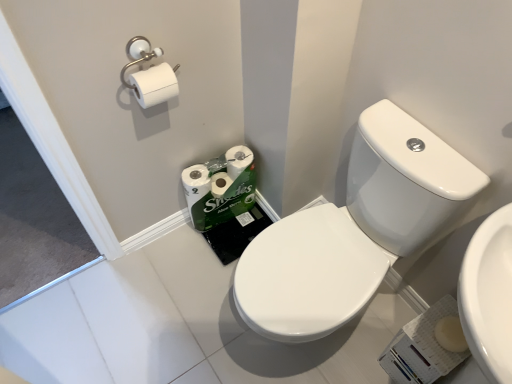
You are a GUI agent. You are given a task and a screenshot of the screen. Output one action in this format:
    pyautogui.click(x=<x>, y=<y>)
    Task: Click on the white matte toilet paper at upper left, arranged as the 2th toilet paper when ordered from the bottom
    
    Given the screenshot: What is the action you would take?
    pyautogui.click(x=154, y=85)

Locate an element on the screen. This screenshot has height=384, width=512. green matte toilet paper at lower center, the 2th toilet paper positioned from the top is located at coordinates (220, 187).

Is white matte toilet paper at upper left, the first toilet paper from the top, facing away from white glossy sink at center right?

white matte toilet paper at upper left, the first toilet paper from the top, is not turned away from white glossy sink at center right.

Is white matte toilet paper at upper left, arranged as the 2th toilet paper when ordered from the bottom, smaller than white glossy sink at center right?

Indeed, white matte toilet paper at upper left, arranged as the 2th toilet paper when ordered from the bottom, has a smaller size compared to white glossy sink at center right.

Do you think white matte toilet paper at upper left, which is the 1th toilet paper from front to back, is within white glossy sink at center right, or outside of it?

white matte toilet paper at upper left, which is the 1th toilet paper from front to back, is located beyond the bounds of white glossy sink at center right.

Can you confirm if green matte toilet paper at lower center, the second toilet paper in the front-to-back sequence, is thinner than white glossy sink at center right?

Correct, the width of green matte toilet paper at lower center, the second toilet paper in the front-to-back sequence, is less than that of white glossy sink at center right.

Based on their sizes in the image, would you say green matte toilet paper at lower center, the 2th toilet paper positioned from the top, is bigger or smaller than white glossy sink at center right?

Considering their sizes, green matte toilet paper at lower center, the 2th toilet paper positioned from the top, takes up less space than white glossy sink at center right.

From the image's perspective, is green matte toilet paper at lower center, which is counted as the first toilet paper, starting from the back, located beneath white glossy sink at center right?

No, from the image's perspective, green matte toilet paper at lower center, which is counted as the first toilet paper, starting from the back, is not below white glossy sink at center right.

From their relative heights in the image, would you say green matte toilet paper at lower center, the 2th toilet paper positioned from the top, is taller or shorter than white glossy sink at center right?

In the image, green matte toilet paper at lower center, the 2th toilet paper positioned from the top, appears to be shorter than white glossy sink at center right.

Locate an element on the screen. The height and width of the screenshot is (384, 512). the 2nd toilet paper behind when counting from the white glossy sink at center right is located at coordinates (220, 187).

Considering the relative sizes of white glossy sink at center right and green matte toilet paper at lower center, which is counted as the first toilet paper, starting from the back, in the image provided, is white glossy sink at center right bigger than green matte toilet paper at lower center, which is counted as the first toilet paper, starting from the back,?

Correct, white glossy sink at center right is larger in size than green matte toilet paper at lower center, which is counted as the first toilet paper, starting from the back.

In the scene shown: Choose the correct answer: Is white glossy sink at center right inside green matte toilet paper at lower center, the 2th toilet paper positioned from the top, or outside it?

white glossy sink at center right lies outside green matte toilet paper at lower center, the 2th toilet paper positioned from the top.

From a real-world perspective, is white glossy sink at center right beneath green matte toilet paper at lower center, the 2th toilet paper positioned from the top?

No, from a real-world perspective, white glossy sink at center right is not under green matte toilet paper at lower center, the 2th toilet paper positioned from the top.

Considering the sizes of objects white glossy sink at center right and white matte toilet paper at upper left, positioned as the second toilet paper in back-to-front order, in the image provided, who is shorter, white glossy sink at center right or white matte toilet paper at upper left, positioned as the second toilet paper in back-to-front order,?

white matte toilet paper at upper left, positioned as the second toilet paper in back-to-front order, is shorter.

Would you say white glossy sink at center right is outside white matte toilet paper at upper left, the first toilet paper from the top?

Yes.

Is the surface of white glossy sink at center right in direct contact with white matte toilet paper at upper left, the first toilet paper from the top?

white glossy sink at center right and white matte toilet paper at upper left, the first toilet paper from the top, are clearly separated.

From a real-world perspective, which is physically below, white glossy sink at center right or white matte toilet paper at upper left, positioned as the second toilet paper in back-to-front order?

white glossy sink at center right.

Relative to green matte toilet paper at lower center, which is the 1th toilet paper from bottom to top, is white matte toilet paper at upper left, which is the 1th toilet paper from front to back, in front or behind?

In the image, white matte toilet paper at upper left, which is the 1th toilet paper from front to back, appears in front of green matte toilet paper at lower center, which is the 1th toilet paper from bottom to top.

Does white matte toilet paper at upper left, the first toilet paper from the top, have a lesser width compared to green matte toilet paper at lower center, the 2th toilet paper positioned from the top?

Yes, white matte toilet paper at upper left, the first toilet paper from the top, is thinner than green matte toilet paper at lower center, the 2th toilet paper positioned from the top.

Which object is positioned more to the left, white matte toilet paper at upper left, positioned as the second toilet paper in back-to-front order, or green matte toilet paper at lower center, the 2th toilet paper positioned from the top?

white matte toilet paper at upper left, positioned as the second toilet paper in back-to-front order, is more to the left.

From the image's perspective, which is below, white matte toilet paper at upper left, the first toilet paper from the top, or green matte toilet paper at lower center, the second toilet paper in the front-to-back sequence?

green matte toilet paper at lower center, the second toilet paper in the front-to-back sequence, appears lower in the image.

Can you tell me how much green matte toilet paper at lower center, which is counted as the first toilet paper, starting from the back, and white matte toilet paper at upper left, the first toilet paper from the top, differ in facing direction?

0.885 degrees.

In the image, is green matte toilet paper at lower center, which is counted as the first toilet paper, starting from the back, positioned in front of or behind white matte toilet paper at upper left, which is the 1th toilet paper from front to back?

green matte toilet paper at lower center, which is counted as the first toilet paper, starting from the back, is behind white matte toilet paper at upper left, which is the 1th toilet paper from front to back.

From the image's perspective, which one is positioned higher, green matte toilet paper at lower center, the 2th toilet paper positioned from the top, or white matte toilet paper at upper left, the first toilet paper from the top?

white matte toilet paper at upper left, the first toilet paper from the top.

Measure the distance from green matte toilet paper at lower center, the 2th toilet paper positioned from the top, to white matte toilet paper at upper left, positioned as the second toilet paper in back-to-front order.

19.88 inches.

I want to click on sink below the white matte toilet paper at upper left, positioned as the second toilet paper in back-to-front order (from a real-world perspective), so click(x=355, y=230).

Locate an element on the screen. sink that is above the green matte toilet paper at lower center, which is counted as the first toilet paper, starting from the back (from a real-world perspective) is located at coordinates (355, 230).

When comparing their distances from white matte toilet paper at upper left, the first toilet paper from the top, does white glossy sink at center right or green matte toilet paper at lower center, which is the 1th toilet paper from bottom to top, seem closer?

green matte toilet paper at lower center, which is the 1th toilet paper from bottom to top, is positioned closer to the anchor white matte toilet paper at upper left, the first toilet paper from the top.

Looking at the image, which one is located closer to green matte toilet paper at lower center, which is counted as the first toilet paper, starting from the back, white glossy sink at center right or white matte toilet paper at upper left, the first toilet paper from the top?

Result: white matte toilet paper at upper left, the first toilet paper from the top, is positioned closer to the anchor green matte toilet paper at lower center, which is counted as the first toilet paper, starting from the back.

Based on their spatial positions, is green matte toilet paper at lower center, which is counted as the first toilet paper, starting from the back, or white glossy sink at center right further from white matte toilet paper at upper left, positioned as the second toilet paper in back-to-front order?

Based on the image, white glossy sink at center right appears to be further to white matte toilet paper at upper left, positioned as the second toilet paper in back-to-front order.

Considering their positions, is white matte toilet paper at upper left, the first toilet paper from the top, positioned closer to white glossy sink at center right than green matte toilet paper at lower center, which is counted as the first toilet paper, starting from the back?

Among the two, green matte toilet paper at lower center, which is counted as the first toilet paper, starting from the back, is located nearer to white glossy sink at center right.

Looking at the image, which one is located closer to green matte toilet paper at lower center, the second toilet paper in the front-to-back sequence, white matte toilet paper at upper left, arranged as the 2th toilet paper when ordered from the bottom, or white glossy sink at center right?

white matte toilet paper at upper left, arranged as the 2th toilet paper when ordered from the bottom, is closer to green matte toilet paper at lower center, the second toilet paper in the front-to-back sequence.

Estimate the real-world distances between objects in this image. Which object is further from white glossy sink at center right, green matte toilet paper at lower center, which is counted as the first toilet paper, starting from the back, or white matte toilet paper at upper left, which is the 1th toilet paper from front to back?

white matte toilet paper at upper left, which is the 1th toilet paper from front to back, is further to white glossy sink at center right.

Identify the location of toilet paper located between white glossy sink at center right and green matte toilet paper at lower center, which is the 1th toilet paper from bottom to top, in the depth direction. (154, 85).